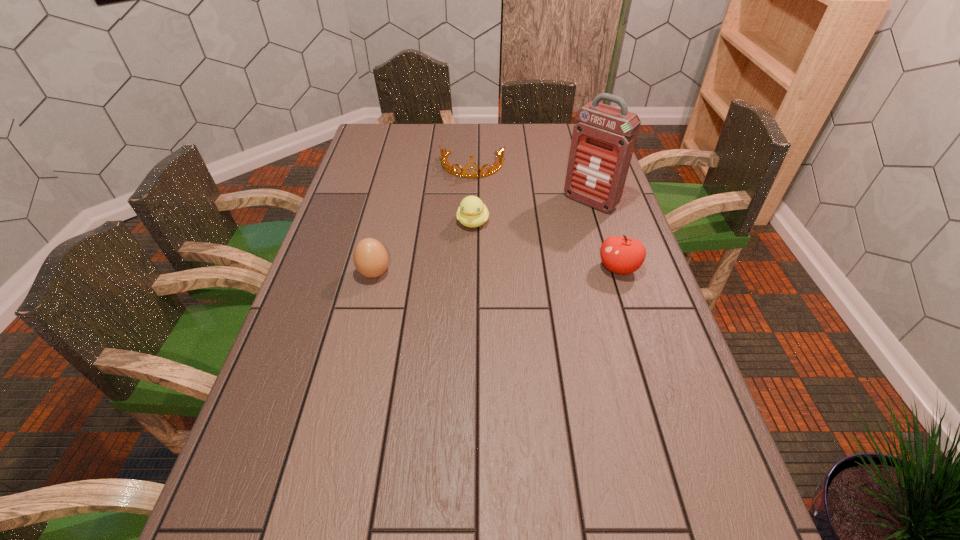
Locate an element on the screen. free space located 0.180m on the front-facing side of the tiara is located at coordinates (470, 212).

Locate an element on the screen. free space located 0.070m on the front-facing side of the tiara is located at coordinates (471, 192).

This screenshot has height=540, width=960. I want to click on free space located on the front-facing side of the tiara, so click(468, 232).

Locate an element on the screen. vacant region located at the beak of the duckling is located at coordinates (468, 249).

The image size is (960, 540). Find the location of `vacant region located at the beak of the duckling`. vacant region located at the beak of the duckling is located at coordinates (464, 268).

I want to click on free point located 0.310m at the beak of the duckling, so click(456, 312).

Where is `object located in the far edge section of the desktop`? The image size is (960, 540). object located in the far edge section of the desktop is located at coordinates (447, 167).

Locate an element on the screen. This screenshot has width=960, height=540. object at the left edge is located at coordinates (370, 257).

What are the coordinates of `apple that is at the right edge` in the screenshot? It's located at (621, 255).

Locate an element on the screen. the first-aid kit at the right edge is located at coordinates (603, 141).